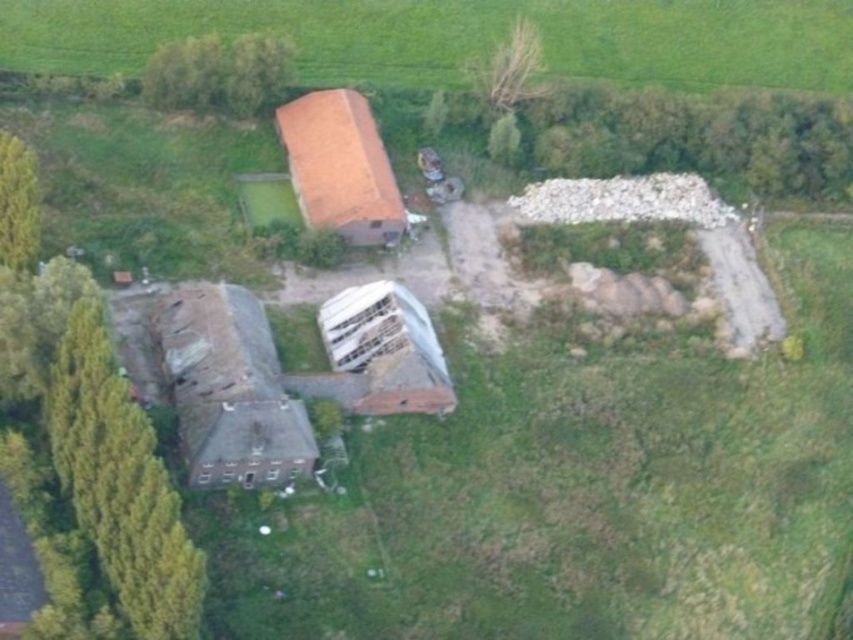
Is brown tile roof at center below green leafy tree at lower left?

Incorrect, brown tile roof at center is not positioned below green leafy tree at lower left.

From the picture: Between brown tile roof at center and green leafy tree at lower left, which one is positioned lower?

green leafy tree at lower left is below.

Which is in front, point (306, 161) or point (0, 182)?

Positioned in front is point (0, 182).

Image resolution: width=853 pixels, height=640 pixels. Identify the location of brown tile roof at center. 340,166.

You are a GUI agent. You are given a task and a screenshot of the screen. Output one action in this format:
    pyautogui.click(x=<x>, y=<y>)
    Task: Click on the green grass at upper center
    The image size is (853, 640).
    Given the screenshot: What is the action you would take?
    pyautogui.click(x=457, y=36)

Is the position of green grass at upper center more distant than that of green leafy tree at upper center?

That is False.

The image size is (853, 640). I want to click on green grass at upper center, so click(x=457, y=36).

Is green leafy tree at left to the right of green leafy tree at lower left from the viewer's perspective?

Yes, green leafy tree at left is to the right of green leafy tree at lower left.

Is green leafy tree at left bigger than green leafy tree at lower left?

Yes.

Is point (163, 630) closer to camera compared to point (9, 253)?

Yes.

Where is `green leafy tree at left`? Image resolution: width=853 pixels, height=640 pixels. green leafy tree at left is located at coordinates (90, 417).